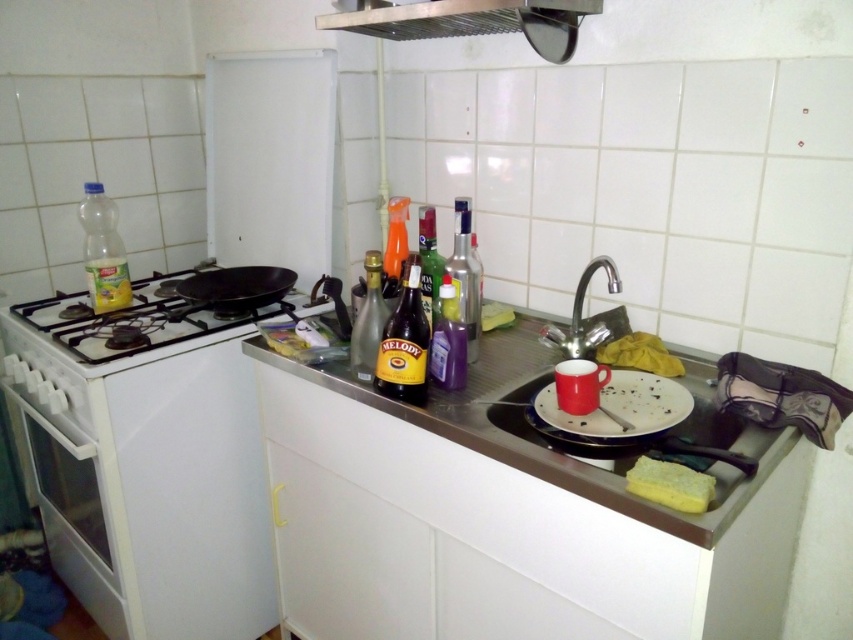
Question: Which object is positioned closest to the satin silver exhaust hood at upper center?

Choices:
 (A) translucent plastic bottle at left
 (B) shiny glass bottle at center

Answer: (B)

Question: Can you confirm if yellow matte bottle at center is bigger than shiny glass bottle at center?

Choices:
 (A) yes
 (B) no

Answer: (A)

Question: Can you confirm if purple glossy bottle at center is positioned to the right of translucent plastic bottle at center?

Choices:
 (A) yes
 (B) no

Answer: (A)

Question: Which of the following is the farthest from the observer?

Choices:
 (A) (428, 323)
 (B) (393, 264)

Answer: (B)

Question: Which object is the farthest from the black matte frying pan at upper left?

Choices:
 (A) white glossy oven at left
 (B) purple glass bottle at center

Answer: (B)

Question: Can you confirm if black matte frying pan at upper left is positioned to the left of translucent orange spray bottle at center?

Choices:
 (A) no
 (B) yes

Answer: (B)